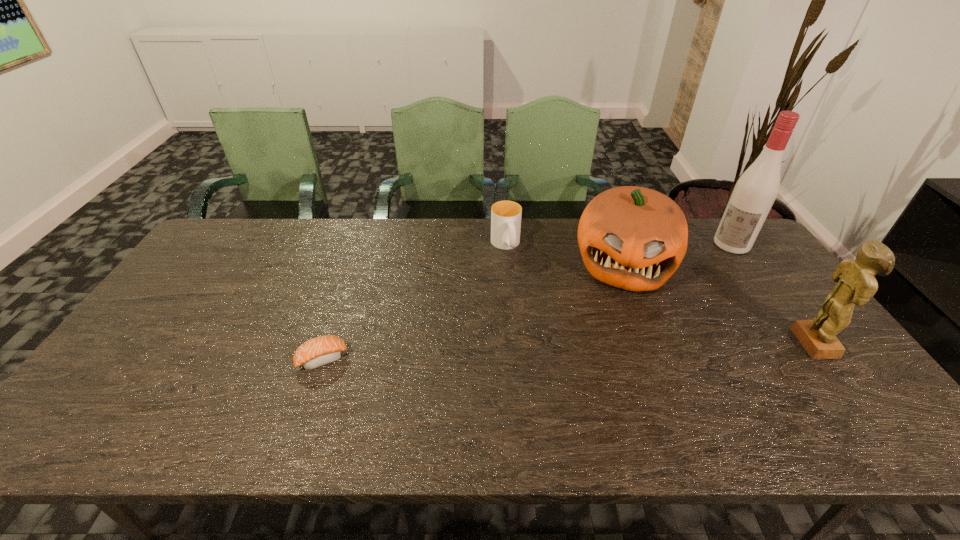
Find the location of a particular element. The height and width of the screenshot is (540, 960). free space located on the face of the pumpkin is located at coordinates (612, 398).

I want to click on vacant point located on the face of the pumpkin, so click(x=615, y=353).

Find the location of a particular element. The width and height of the screenshot is (960, 540). free location located 0.300m on the label of the alcohol is located at coordinates (686, 298).

Find the location of a particular element. The width and height of the screenshot is (960, 540). vacant space located on the label of the alcohol is located at coordinates (709, 271).

You are a GUI agent. You are given a task and a screenshot of the screen. Output one action in this format:
    pyautogui.click(x=<x>, y=<y>)
    Task: Click on the free space located on the label of the alcohol
    
    Given the screenshot: What is the action you would take?
    pyautogui.click(x=699, y=283)

This screenshot has width=960, height=540. Identify the location of vacant region located with the handle on the side of the fourth tallest object. (535, 326).

Identify the location of vacant space situated with the handle on the side of the fourth tallest object. The width and height of the screenshot is (960, 540). coord(535,326).

Image resolution: width=960 pixels, height=540 pixels. What are the coordinates of `blank area located 0.160m with the handle on the side of the fourth tallest object` in the screenshot? It's located at coord(522,292).

I want to click on pumpkin at the far edge, so click(634, 238).

Where is `alcohol that is at the far edge`? alcohol that is at the far edge is located at coordinates (757, 188).